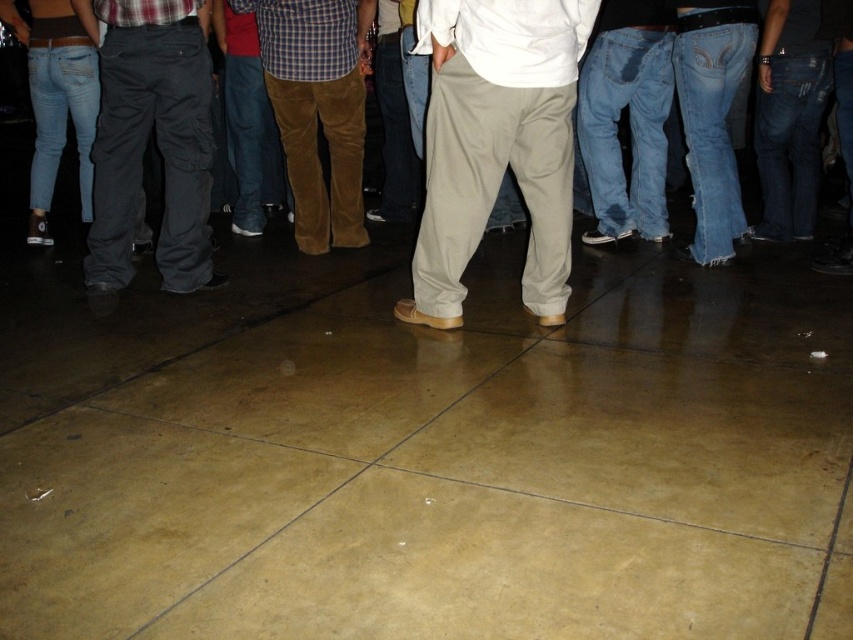
Question: Which point is farther to the camera?

Choices:
 (A) brown corduroy pants at center
 (B) matte khaki pants at center
 (C) dark gray cotton pants at left

Answer: (A)

Question: Can you confirm if dark gray cotton pants at left is smaller than brown corduroy pants at center?

Choices:
 (A) no
 (B) yes

Answer: (B)

Question: Which point appears farthest from the camera in this image?

Choices:
 (A) (105, 260)
 (B) (360, 86)

Answer: (B)

Question: Which object is farther from the camera taking this photo?

Choices:
 (A) khaki pants at center
 (B) dark gray cotton pants at left
 (C) brown corduroy pants at center
 (D) matte khaki pants at center

Answer: (C)

Question: Can you confirm if dark gray cotton pants at left is smaller than brown corduroy pants at center?

Choices:
 (A) yes
 (B) no

Answer: (A)

Question: In this image, where is matte khaki pants at center located relative to dark gray cotton pants at left?

Choices:
 (A) right
 (B) left

Answer: (A)